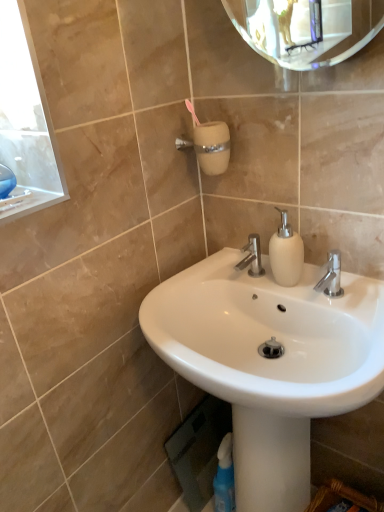
Where is `white matte soap dispenser at center`? Image resolution: width=384 pixels, height=512 pixels. white matte soap dispenser at center is located at coordinates coord(286,253).

Find the location of `white matte soap dispenser at center`. white matte soap dispenser at center is located at coordinates (286, 253).

Which object is more forward, white matte soap dispenser at center or white glossy sink at center?

white glossy sink at center.

Is white matte soap dispenser at center completely or partially outside of white glossy sink at center?

Indeed, white matte soap dispenser at center is completely outside white glossy sink at center.

Is white matte soap dispenser at center oriented away from white glossy sink at center?

No.

Considering the points (295, 281) and (163, 294), which point is in front, point (295, 281) or point (163, 294)?

The point (295, 281) is in front.

Is polished chrome faucet at center to the left or to the right of white glossy sink at center in the image?

Based on their positions, polished chrome faucet at center is located to the left of white glossy sink at center.

Can you confirm if polished chrome faucet at center is shorter than white glossy sink at center?

Indeed, polished chrome faucet at center has a lesser height compared to white glossy sink at center.

This screenshot has width=384, height=512. What are the coordinates of `tap above the white glossy sink at center (from a real-world perspective)` in the screenshot? It's located at pos(252,257).

Considering the relative sizes of polished chrome faucet at center and white glossy sink at center in the image provided, is polished chrome faucet at center bigger than white glossy sink at center?

No, polished chrome faucet at center is not bigger than white glossy sink at center.

Considering their positions, is polished chrome faucet at center located in front of or behind white matte soap dispenser at center?

Clearly, polished chrome faucet at center is behind white matte soap dispenser at center.

Does polished chrome faucet at center have a lesser width compared to white matte soap dispenser at center?

No.

Is white matte soap dispenser at center facing away from polished chrome faucet at center?

white matte soap dispenser at center does not have its back to polished chrome faucet at center.

Considering the sizes of objects white matte soap dispenser at center and polished chrome faucet at center in the image provided, who is smaller, white matte soap dispenser at center or polished chrome faucet at center?

With smaller size is polished chrome faucet at center.

Looking at this image, considering the positions of objects white matte soap dispenser at center and polished chrome faucet at center in the image provided, who is more to the right, white matte soap dispenser at center or polished chrome faucet at center?

white matte soap dispenser at center.

Is white matte soap dispenser at center in contact with polished chrome faucet at center?

No, white matte soap dispenser at center is not making contact with polished chrome faucet at center.

Between white glossy sink at center and polished chrome faucet at center, which one has larger size?

Bigger between the two is white glossy sink at center.

Is white glossy sink at center wider or thinner than polished chrome faucet at center?

In the image, white glossy sink at center appears to be wider than polished chrome faucet at center.

From a real-world perspective, is white glossy sink at center under polished chrome faucet at center?

Indeed, from a real-world perspective, white glossy sink at center is positioned beneath polished chrome faucet at center.

Which is closer, (x=199, y=281) or (x=286, y=276)?

The point (x=286, y=276) is more forward.

Identify the location of soap dispenser lying above the white glossy sink at center (from the image's perspective). (286, 253).

Is white glossy sink at center positioned with its back to white matte soap dispenser at center?

No, white glossy sink at center is not facing away from white matte soap dispenser at center.

From a real-world perspective, is white glossy sink at center on white matte soap dispenser at center?

Actually, white glossy sink at center is physically below white matte soap dispenser at center in the real world.

Find the location of a particular element. soap dispenser above the white glossy sink at center (from the image's perspective) is located at coordinates (286, 253).

Where is `sink below the polished chrome faucet at center (from a real-world perspective)`? sink below the polished chrome faucet at center (from a real-world perspective) is located at coordinates (270, 362).

Based on their spatial positions, is white glossy sink at center or white matte soap dispenser at center further from polished chrome faucet at center?

white glossy sink at center is further to polished chrome faucet at center.

Which object lies nearer to the anchor point white matte soap dispenser at center, polished chrome faucet at center or white glossy sink at center?

polished chrome faucet at center is closer to white matte soap dispenser at center.

Estimate the real-world distances between objects in this image. Which object is closer to white matte soap dispenser at center, white glossy sink at center or polished chrome faucet at center?

Based on the image, polished chrome faucet at center appears to be nearer to white matte soap dispenser at center.

Which object lies nearer to the anchor point white glossy sink at center, polished chrome faucet at center or white matte soap dispenser at center?

Among the two, white matte soap dispenser at center is located nearer to white glossy sink at center.

Which object lies further to the anchor point white glossy sink at center, white matte soap dispenser at center or polished chrome faucet at center?

polished chrome faucet at center.

Which object lies further to the anchor point polished chrome faucet at center, white matte soap dispenser at center or white glossy sink at center?

white glossy sink at center lies further to polished chrome faucet at center than the other object.

Find the location of a particular element. The height and width of the screenshot is (512, 384). soap dispenser located between white glossy sink at center and polished chrome faucet at center in the depth direction is located at coordinates (286, 253).